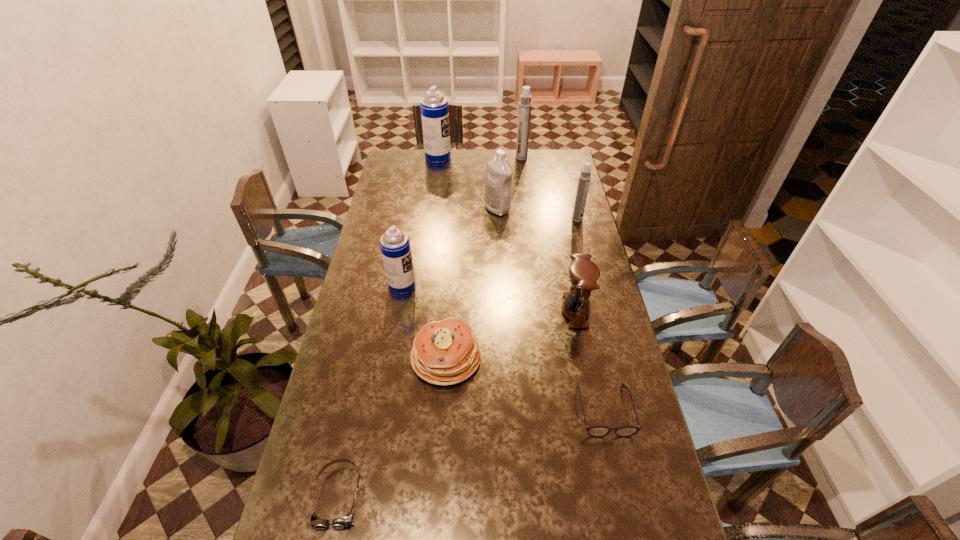
Image resolution: width=960 pixels, height=540 pixels. In the image, there is a desktop. What are the coordinates of `vacant space at the right edge` in the screenshot? It's located at coord(570,220).

Identify the location of free point at the far left corner. The height and width of the screenshot is (540, 960). (396, 170).

Identify the location of free space between the white detergent and the smaller white aerosol can. Image resolution: width=960 pixels, height=540 pixels. (537, 214).

Find the location of a particular element. This screenshot has height=540, width=960. empty space between the nearest aerosol can and the spectacles is located at coordinates (503, 347).

Image resolution: width=960 pixels, height=540 pixels. Identify the location of vacant point located between the brown goggles and the spectacles. (471, 453).

Image resolution: width=960 pixels, height=540 pixels. Identify the location of free space between the third shortest object and the nearer blue aerosol can. (424, 321).

Where is `unoccupied area between the seventh tallest object and the sixth tallest object`? Image resolution: width=960 pixels, height=540 pixels. unoccupied area between the seventh tallest object and the sixth tallest object is located at coordinates (511, 334).

I want to click on blank region between the nearest object and the third shortest object, so click(x=393, y=426).

The height and width of the screenshot is (540, 960). In order to click on free point between the sixth tallest object and the smaller blue aerosol can in this screenshot , I will do `click(489, 298)`.

You are a GUI agent. You are given a task and a screenshot of the screen. Output one action in this format:
    pyautogui.click(x=<x>, y=<y>)
    Task: Click on the closest object to the spectacles
    
    Given the screenshot: What is the action you would take?
    click(x=583, y=274)